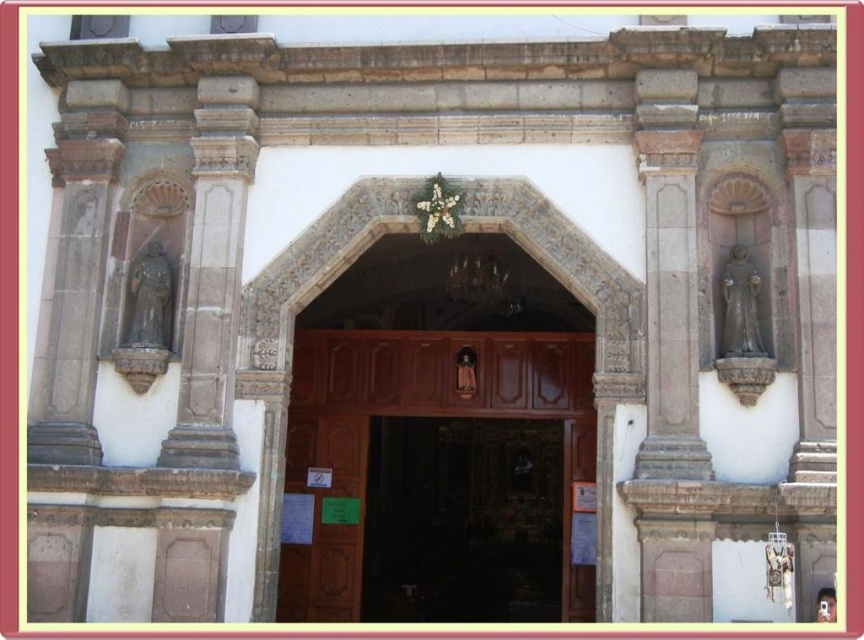
Question: Which point is closer to the camera?

Choices:
 (A) pos(200,337)
 (B) pos(363,445)

Answer: (A)

Question: Which point is closer to the camera taking this photo?

Choices:
 (A) (297, 369)
 (B) (195, 161)

Answer: (B)

Question: Does brown polished wood door at center come in front of brown wooden door at center?

Choices:
 (A) yes
 (B) no

Answer: (B)

Question: Does brown polished wood door at center have a lesser width compared to smooth stone statue at left?

Choices:
 (A) yes
 (B) no

Answer: (B)

Question: Estimate the real-world distances between objects in this image. Which object is closer to the smooth stone statue at left?

Choices:
 (A) brown wooden door at center
 (B) brown polished wood door at center

Answer: (A)

Question: Does smooth stone statue at left appear on the left side of brown wooden door at center?

Choices:
 (A) yes
 (B) no

Answer: (A)